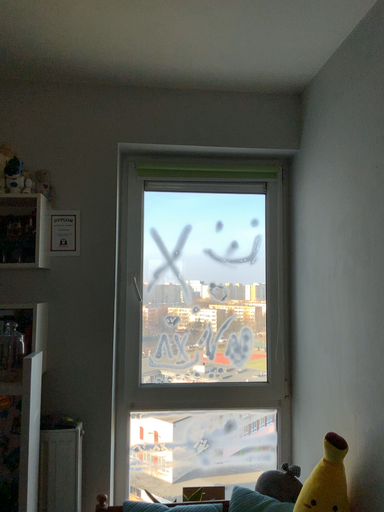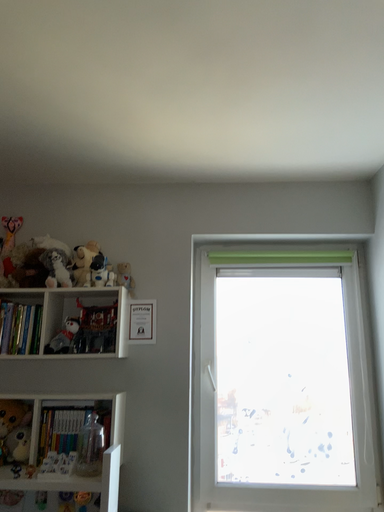
Question: How did the camera likely rotate when shooting the video?

Choices:
 (A) rotated left
 (B) rotated right

Answer: (A)